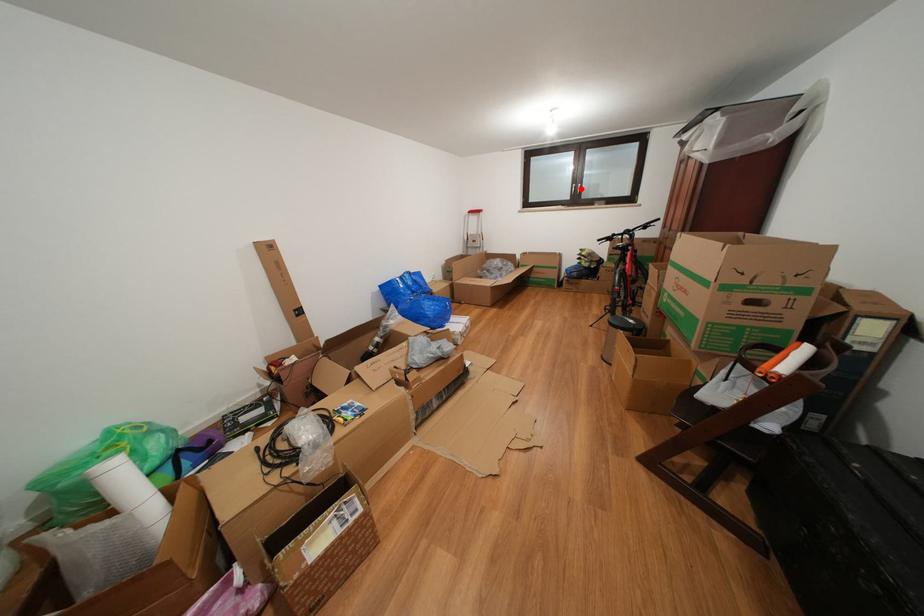
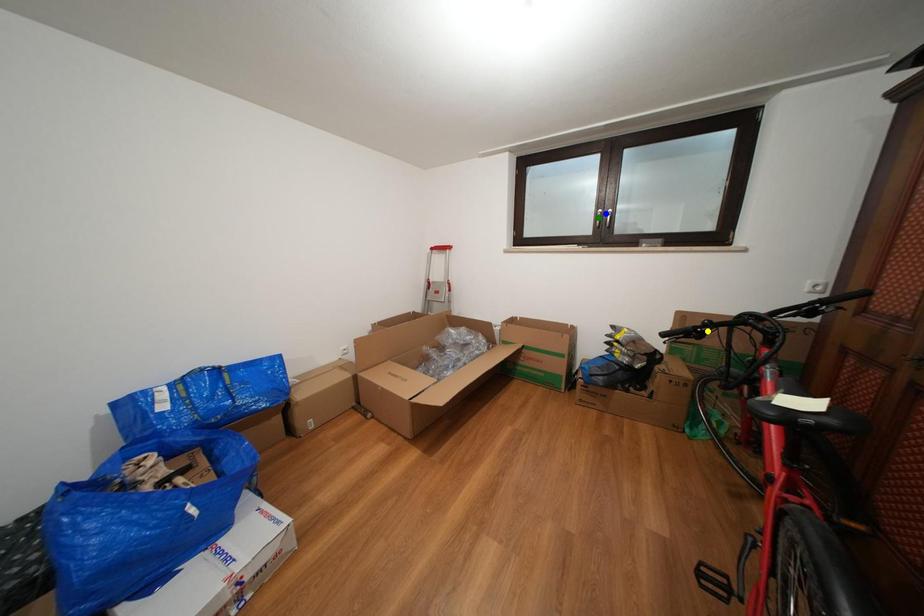
Question: I am providing you with two images of the same scene from different viewpoints. A red point is marked on the first image. You are given multiple points on the second image. Which spot in image 2 lines up with the point in image 1?

Choices:
 (A) yellow point
 (B) green point
 (C) blue point

Answer: (C)